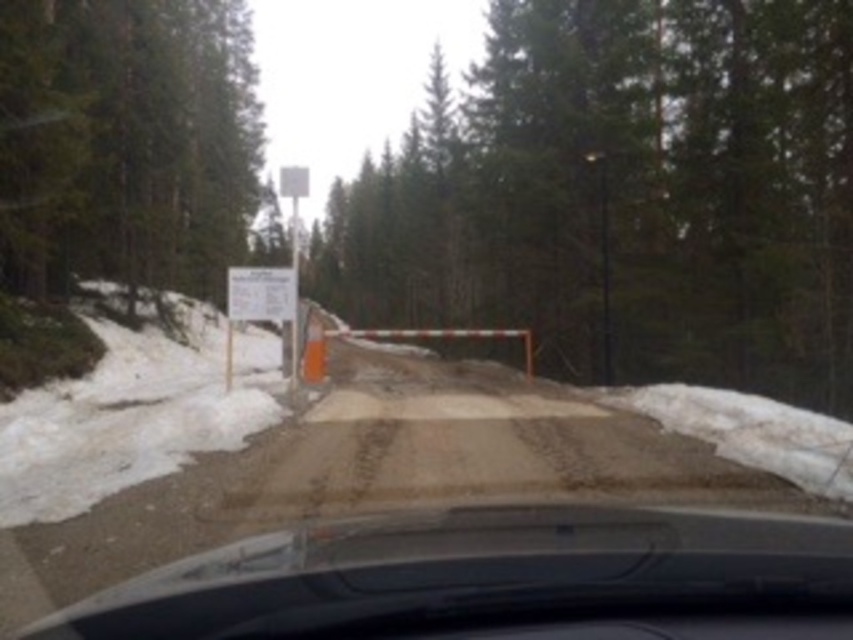
From the picture: How distant is green matte tree at center from white paper sign at center?

1308.51 feet

Between point (350, 257) and point (231, 272), which one is positioned behind?

The point (350, 257) is behind.

You are a GUI agent. You are given a task and a screenshot of the screen. Output one action in this format:
    pyautogui.click(x=<x>, y=<y>)
    Task: Click on the green matte tree at center
    
    Given the screenshot: What is the action you would take?
    pyautogui.click(x=625, y=196)

Where is `green matte tree at center`? The height and width of the screenshot is (640, 853). green matte tree at center is located at coordinates (625, 196).

Who is shorter, transparent glass windshield at center or green matte tree at upper left?

transparent glass windshield at center

Can you confirm if transparent glass windshield at center is smaller than green matte tree at upper left?

Yes, transparent glass windshield at center is smaller than green matte tree at upper left.

Between point (642, 552) and point (1, 38), which one is positioned in front?

Point (642, 552) is in front.

Locate an element on the screen. transparent glass windshield at center is located at coordinates (492, 579).

Is green matte tree at center shorter than green matte tree at upper left?

Yes.

Is green matte tree at center further to camera compared to green matte tree at upper left?

That is False.

Identify the location of green matte tree at center. The height and width of the screenshot is (640, 853). (625, 196).